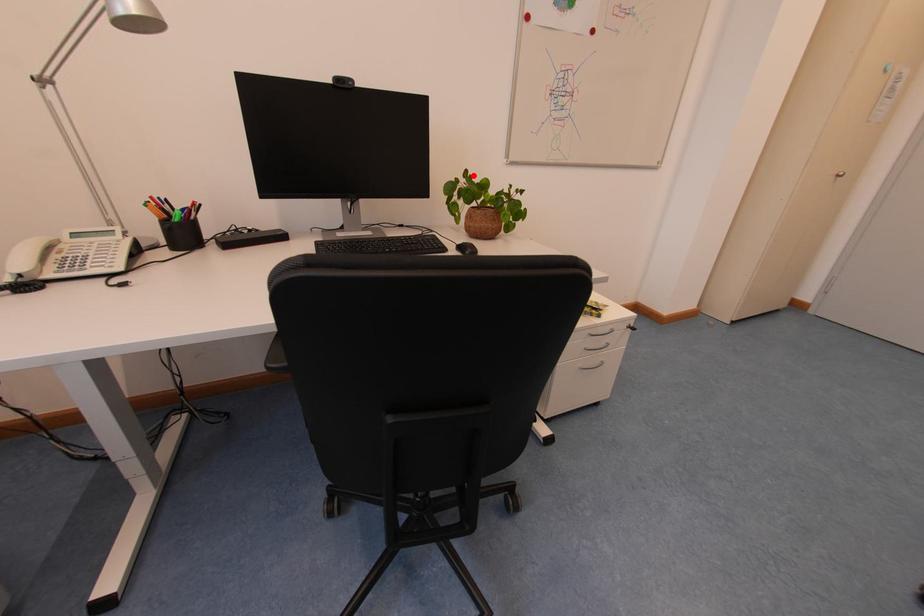
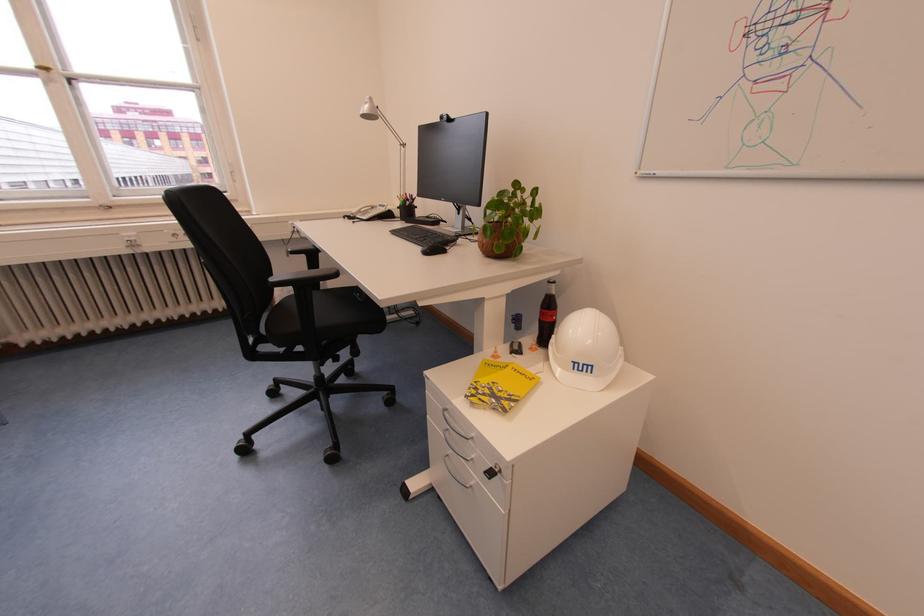
The point at the highlighted location is marked in the first image. Where is the corresponding point in the second image?

(524, 187)